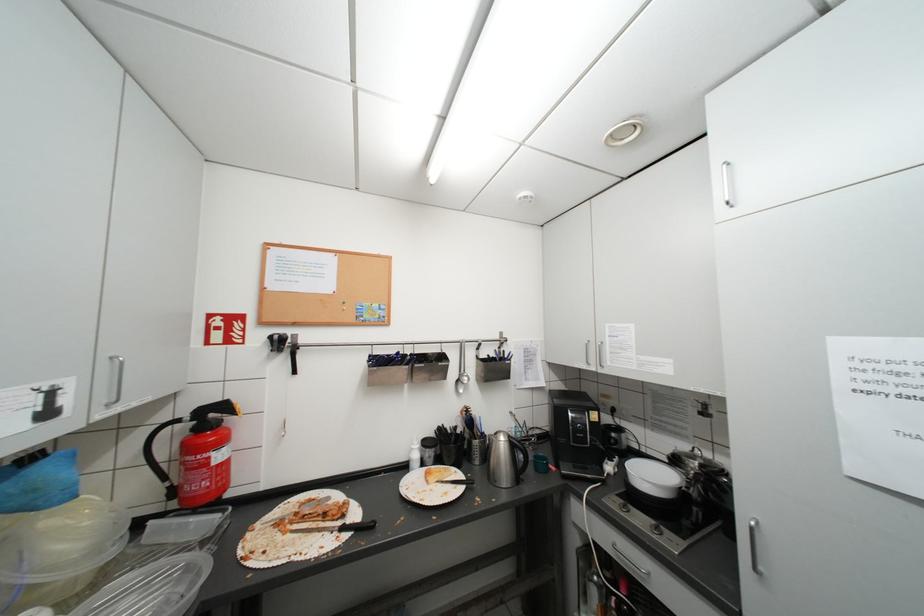
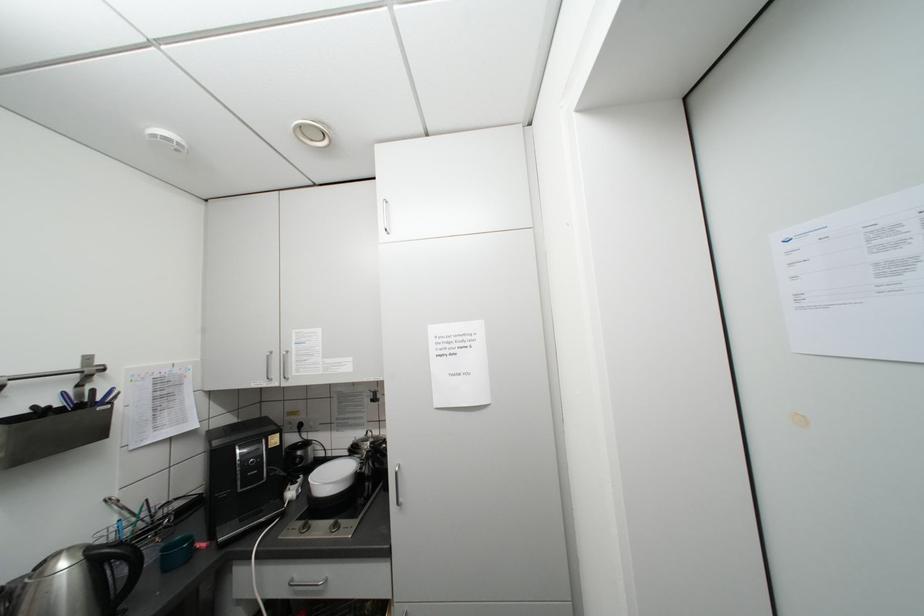
Question: The camera is either moving clockwise (left) or counter-clockwise (right) around the object. The first image is from the beginning of the video and the second image is from the end. Is the camera moving left or right when shooting the video?

Choices:
 (A) Left
 (B) Right

Answer: (A)